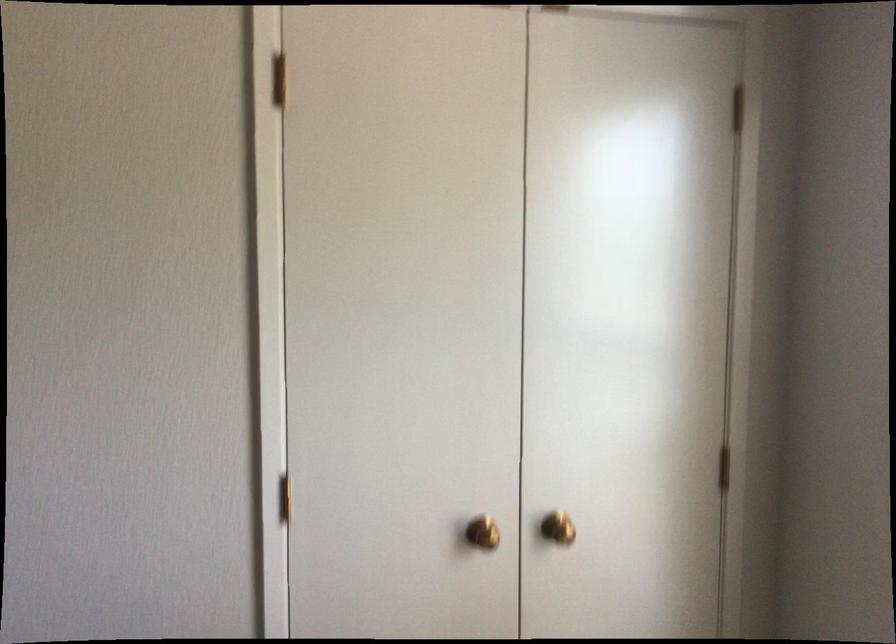
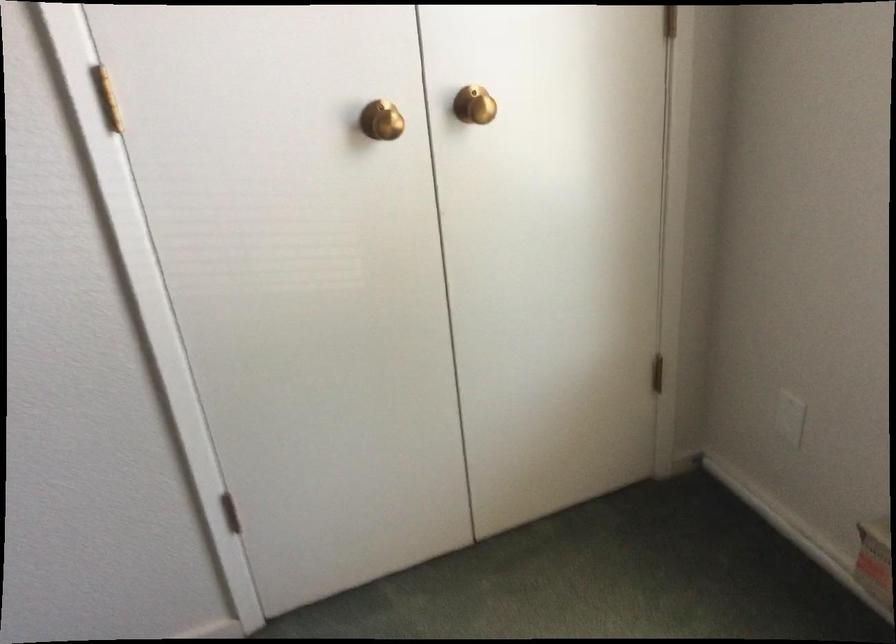
Question: Which direction would the cameraman need to move to produce the second image? Reply with the corresponding letter.

Choices:
 (A) Left
 (B) Right
 (C) Forward
 (D) Backward

Answer: (C)